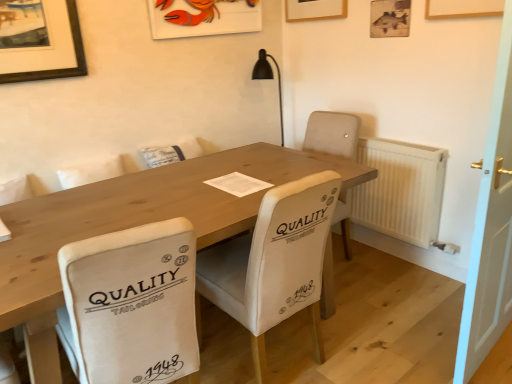
Question: From a real-world perspective, is white plastic radiator at right physically above white wooden door at right?

Choices:
 (A) no
 (B) yes

Answer: (A)

Question: Can you confirm if white plastic radiator at right is bigger than white wooden door at right?

Choices:
 (A) yes
 (B) no

Answer: (B)

Question: Is white plastic radiator at right behind white wooden door at right?

Choices:
 (A) no
 (B) yes

Answer: (B)

Question: Does white plastic radiator at right touch white wooden door at right?

Choices:
 (A) yes
 (B) no

Answer: (B)

Question: Is white plastic radiator at right aimed at white wooden door at right?

Choices:
 (A) yes
 (B) no

Answer: (B)

Question: Looking at their shapes, would you say white plastic radiator at right is wider or thinner than white fabric chair at center, which is counted as the first chair, starting from the left?

Choices:
 (A) thin
 (B) wide

Answer: (A)

Question: From the image's perspective, is white plastic radiator at right located above or below white fabric chair at center, which ranks as the 2th chair in right-to-left order?

Choices:
 (A) below
 (B) above

Answer: (B)

Question: Visually, is white plastic radiator at right positioned to the left or to the right of white fabric chair at center, which is counted as the first chair, starting from the left?

Choices:
 (A) left
 (B) right

Answer: (B)

Question: Is point (423, 147) positioned closer to the camera than point (79, 253)?

Choices:
 (A) farther
 (B) closer

Answer: (A)

Question: Looking at their shapes, would you say white plastic radiator at right is wider or thinner than matte plastic picture frame at upper center, which ranks as the 2th picture frame in right-to-left order?

Choices:
 (A) wide
 (B) thin

Answer: (A)

Question: Considering the positions of white plastic radiator at right and matte plastic picture frame at upper center, which ranks as the 2th picture frame in right-to-left order, in the image, is white plastic radiator at right bigger or smaller than matte plastic picture frame at upper center, which ranks as the 2th picture frame in right-to-left order,?

Choices:
 (A) big
 (B) small

Answer: (A)

Question: From the image's perspective, relative to matte plastic picture frame at upper center, the 1th picture frame from the left, is white plastic radiator at right above or below?

Choices:
 (A) above
 (B) below

Answer: (B)

Question: From a real-world perspective, is white plastic radiator at right positioned above or below matte plastic picture frame at upper center, the 1th picture frame from the left?

Choices:
 (A) above
 (B) below

Answer: (B)

Question: Looking at the image, does matte plastic picture frame at upper center, which ranks as the 2th picture frame in right-to-left order, seem bigger or smaller compared to white fabric chair at center, arranged as the second chair when viewed from the left?

Choices:
 (A) small
 (B) big

Answer: (A)

Question: Do you think matte plastic picture frame at upper center, which ranks as the 2th picture frame in right-to-left order, is within white fabric chair at center, arranged as the second chair when viewed from the left, or outside of it?

Choices:
 (A) inside
 (B) outside

Answer: (B)